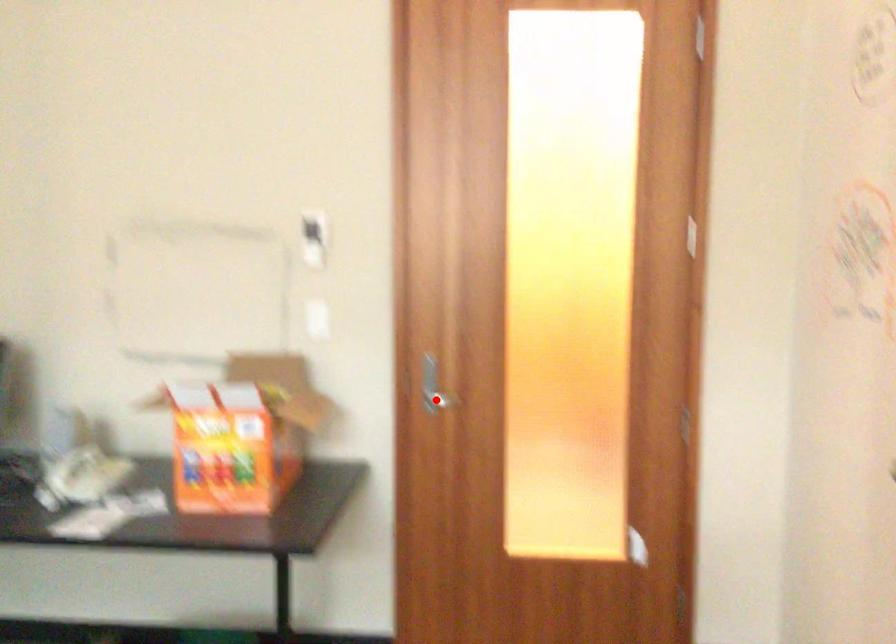
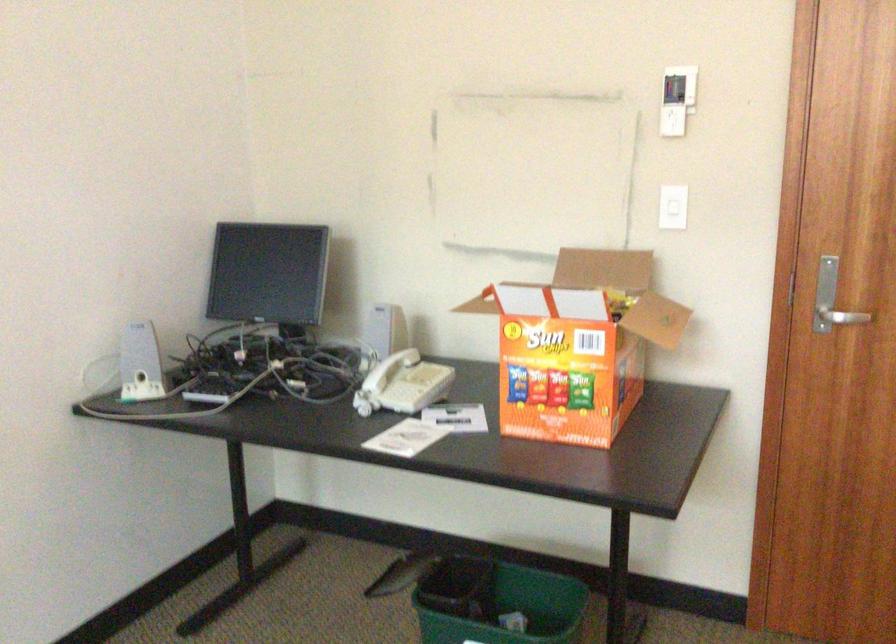
Question: A red point is marked in image1. In image2, is the corresponding 3D point closer to the camera or farther? Reply with the corresponding letter.

Choices:
 (A) The corresponding 3D point is closer.
 (B) The corresponding 3D point is farther.

Answer: (A)